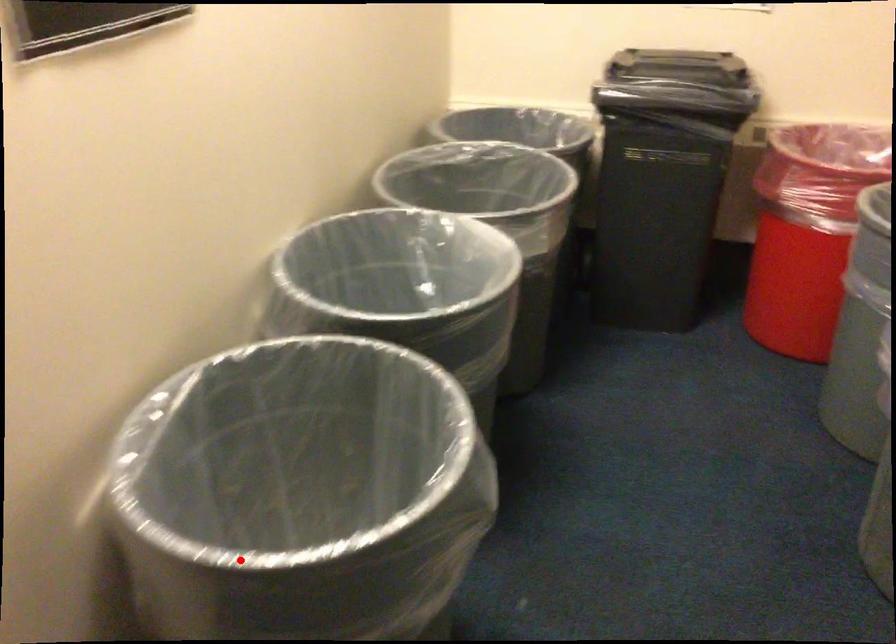
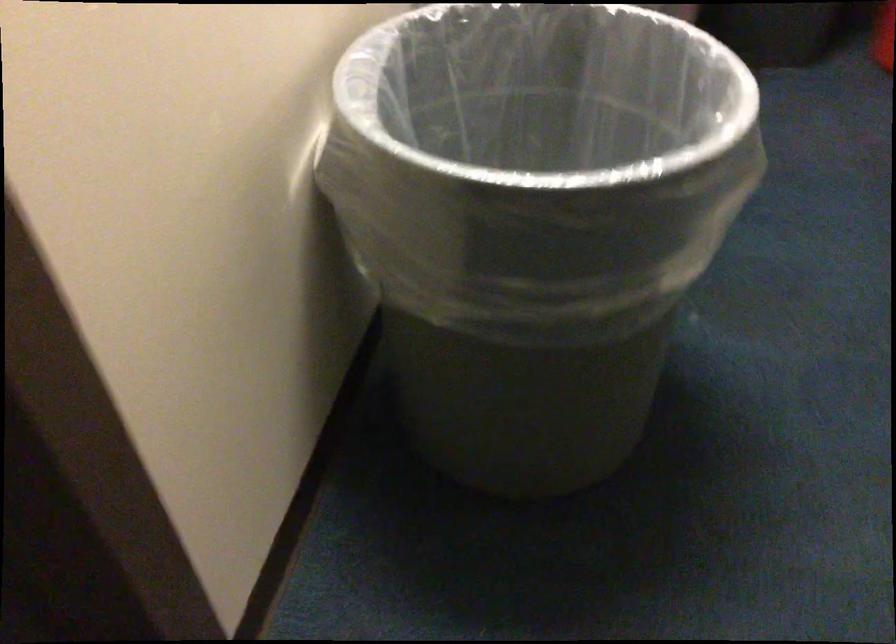
Question: I am providing you with two images of the same scene from different viewpoints. A red point is shown in image1. For the corresponding object point in image2, is it positioned nearer or farther from the camera?

Choices:
 (A) Nearer
 (B) Farther

Answer: (A)